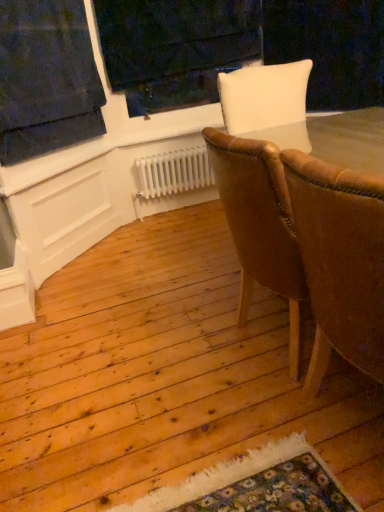
Where is `dark blue fabric at upper left`? This screenshot has height=512, width=384. dark blue fabric at upper left is located at coordinates (46, 79).

This screenshot has width=384, height=512. I want to click on brown leather chair at center, which is the first chair in back-to-front order, so click(260, 224).

What is the approximate height of brown leather chair at center, placed as the 2th chair when sorted from front to back?

35.93 inches.

What do you see at coordinates (174, 172) in the screenshot?
I see `white metallic radiator at center` at bounding box center [174, 172].

You are a GUI agent. You are given a task and a screenshot of the screen. Output one action in this format:
    pyautogui.click(x=<x>, y=<y>)
    Task: Click on the brown leather chair at right, which ranks as the 1th chair in front-to-back order
    
    Given the screenshot: What is the action you would take?
    pyautogui.click(x=340, y=261)

You are a GUI agent. You are given a task and a screenshot of the screen. Output one action in this format:
    pyautogui.click(x=<x>, y=<y>)
    Task: Click on the 1st chair in front of the dark blue fabric at upper left
    This screenshot has width=384, height=512.
    Given the screenshot: What is the action you would take?
    pyautogui.click(x=260, y=224)

Is brown leather chair at center, which is the first chair in back-to-front order, not within dark blue fabric at upper left?

Indeed, brown leather chair at center, which is the first chair in back-to-front order, is completely outside dark blue fabric at upper left.

From a real-world perspective, between brown leather chair at center, placed as the 2th chair when sorted from front to back, and dark blue fabric at upper left, who is vertically lower?

brown leather chair at center, placed as the 2th chair when sorted from front to back, from a real-world perspective.

Could you tell me if brown leather chair at center, placed as the 2th chair when sorted from front to back, is facing dark blue fabric at upper left?

No, brown leather chair at center, placed as the 2th chair when sorted from front to back, is not oriented towards dark blue fabric at upper left.

Based on the photo, from the image's perspective, is brown leather chair at right, which ranks as the 1th chair in front-to-back order, above or below white painted wood at upper center?

From the image's perspective, brown leather chair at right, which ranks as the 1th chair in front-to-back order, appears below white painted wood at upper center.

From a real-world perspective, is brown leather chair at right, acting as the 2th chair starting from the back, physically located above or below white painted wood at upper center?

Clearly, from a real-world perspective, brown leather chair at right, acting as the 2th chair starting from the back, is below white painted wood at upper center.

There is a brown leather chair at right, acting as the 2th chair starting from the back. Identify the location of window frame above it (from a real-world perspective). (175, 48).

Does brown leather chair at right, acting as the 2th chair starting from the back, turn towards white painted wood at upper center?

No, brown leather chair at right, acting as the 2th chair starting from the back, is not facing towards white painted wood at upper center.

Would you consider brown leather chair at center, placed as the 2th chair when sorted from front to back, to be distant from white painted wood at upper center?

Indeed, brown leather chair at center, placed as the 2th chair when sorted from front to back, is not near white painted wood at upper center.

Is brown leather chair at center, placed as the 2th chair when sorted from front to back, positioned with its back to white painted wood at upper center?

No.

From a real-world perspective, between brown leather chair at center, placed as the 2th chair when sorted from front to back, and white painted wood at upper center, who is vertically higher?

white painted wood at upper center.

Looking at this image, could white painted wood at upper center be considered to be inside brown leather chair at center, placed as the 2th chair when sorted from front to back?

No, brown leather chair at center, placed as the 2th chair when sorted from front to back, does not contain white painted wood at upper center.

Considering the sizes of dark blue fabric at upper left and white painted wood at upper center in the image, is dark blue fabric at upper left taller or shorter than white painted wood at upper center?

In the image, dark blue fabric at upper left appears to be shorter than white painted wood at upper center.

Between dark blue fabric at upper left and white painted wood at upper center, which one is positioned in front?

Positioned in front is dark blue fabric at upper left.

From the image's perspective, is dark blue fabric at upper left above or below white painted wood at upper center?

Clearly, from the image's perspective, dark blue fabric at upper left is below white painted wood at upper center.

You are a GUI agent. You are given a task and a screenshot of the screen. Output one action in this format:
    pyautogui.click(x=<x>, y=<y>)
    Task: Click on the curtain above the brown leather chair at right, which ranks as the 1th chair in front-to-back order (from the image's perspective)
    This screenshot has height=512, width=384.
    Given the screenshot: What is the action you would take?
    pyautogui.click(x=46, y=79)

Visually, is dark blue fabric at upper left positioned to the left or to the right of brown leather chair at right, which ranks as the 1th chair in front-to-back order?

In the image, dark blue fabric at upper left appears on the left side of brown leather chair at right, which ranks as the 1th chair in front-to-back order.

Based on their sizes in the image, would you say dark blue fabric at upper left is bigger or smaller than brown leather chair at right, acting as the 2th chair starting from the back?

In the image, dark blue fabric at upper left appears to be smaller than brown leather chair at right, acting as the 2th chair starting from the back.

In the scene shown: Between dark blue fabric at upper left and brown leather chair at right, acting as the 2th chair starting from the back, which one is positioned behind?

Positioned behind is dark blue fabric at upper left.

Consider the image. Considering the sizes of objects white metallic radiator at center and brown leather chair at right, which ranks as the 1th chair in front-to-back order, in the image provided, who is wider, white metallic radiator at center or brown leather chair at right, which ranks as the 1th chair in front-to-back order,?

brown leather chair at right, which ranks as the 1th chair in front-to-back order.

At what (x,y) coordinates should I click in order to perform the action: click on the 2nd chair below the white metallic radiator at center (from the image's perspective). Please return your answer as a coordinate pair (x, y). Image resolution: width=384 pixels, height=512 pixels. Looking at the image, I should click on (340, 261).

Choose the correct answer: Is white metallic radiator at center inside brown leather chair at right, acting as the 2th chair starting from the back, or outside it?

white metallic radiator at center lies outside brown leather chair at right, acting as the 2th chair starting from the back.

How different are the orientations of white metallic radiator at center and brown leather chair at right, acting as the 2th chair starting from the back, in degrees?

There is a 90.7-degree angle between the facing directions of white metallic radiator at center and brown leather chair at right, acting as the 2th chair starting from the back.

Would you say white painted wood at upper center contains dark blue fabric at upper left?

No, dark blue fabric at upper left is not surrounded by white painted wood at upper center.

Between white painted wood at upper center and dark blue fabric at upper left, which one appears on the left side from the viewer's perspective?

From the viewer's perspective, dark blue fabric at upper left appears more on the left side.

Which object is wider, white painted wood at upper center or dark blue fabric at upper left?

With larger width is white painted wood at upper center.

Locate an element on the screen. This screenshot has height=512, width=384. curtain that is above the brown leather chair at center, placed as the 2th chair when sorted from front to back (from a real-world perspective) is located at coordinates (46, 79).

The width and height of the screenshot is (384, 512). There is a white painted wood at upper center. In order to click on the 2nd chair below it (from the image's perspective) in this screenshot , I will do `click(340, 261)`.

Looking at the image, which one is located further to brown leather chair at right, which ranks as the 1th chair in front-to-back order, white painted wood at upper center or brown leather chair at center, placed as the 2th chair when sorted from front to back?

white painted wood at upper center.

When comparing their distances from brown leather chair at right, which ranks as the 1th chair in front-to-back order, does dark blue fabric at upper left or white painted wood at upper center seem further?

The object further to brown leather chair at right, which ranks as the 1th chair in front-to-back order, is white painted wood at upper center.

Estimate the real-world distances between objects in this image. Which object is further from white metallic radiator at center, dark blue fabric at upper left or brown leather chair at center, which is the first chair in back-to-front order?

Among the two, brown leather chair at center, which is the first chair in back-to-front order, is located further to white metallic radiator at center.

Based on the photo, from the image, which object appears to be nearer to white metallic radiator at center, dark blue fabric at upper left or white painted wood at upper center?

Based on the image, white painted wood at upper center appears to be nearer to white metallic radiator at center.

Estimate the real-world distances between objects in this image. Which object is closer to white painted wood at upper center, white metallic radiator at center or brown leather chair at right, acting as the 2th chair starting from the back?

white metallic radiator at center.

Looking at the image, which one is located further to white painted wood at upper center, brown leather chair at right, acting as the 2th chair starting from the back, or dark blue fabric at upper left?

The object further to white painted wood at upper center is brown leather chair at right, acting as the 2th chair starting from the back.

Based on their spatial positions, is white painted wood at upper center or white metallic radiator at center further from dark blue fabric at upper left?

Among the two, white metallic radiator at center is located further to dark blue fabric at upper left.

Which object lies nearer to the anchor point dark blue fabric at upper left, brown leather chair at center, placed as the 2th chair when sorted from front to back, or white metallic radiator at center?

white metallic radiator at center.

Find the location of `window frame between brown leather chair at center, placed as the 2th chair when sorted from front to back, and white metallic radiator at center in the front-back direction`. window frame between brown leather chair at center, placed as the 2th chair when sorted from front to back, and white metallic radiator at center in the front-back direction is located at coordinates (175, 48).

Locate an element on the screen. The width and height of the screenshot is (384, 512). curtain positioned between brown leather chair at center, which is the first chair in back-to-front order, and white metallic radiator at center from near to far is located at coordinates (46, 79).

The height and width of the screenshot is (512, 384). Find the location of `window frame located between brown leather chair at right, acting as the 2th chair starting from the back, and white metallic radiator at center in the depth direction`. window frame located between brown leather chair at right, acting as the 2th chair starting from the back, and white metallic radiator at center in the depth direction is located at coordinates (175, 48).

Find the location of a particular element. chair positioned between brown leather chair at right, acting as the 2th chair starting from the back, and white painted wood at upper center from near to far is located at coordinates (260, 224).